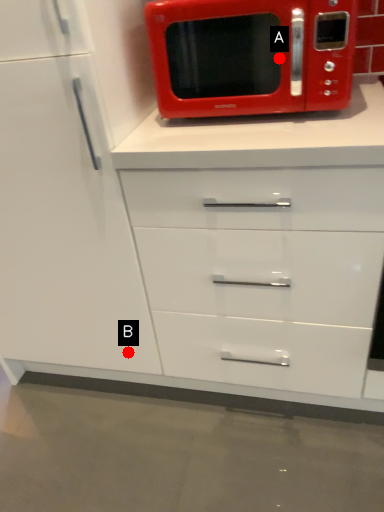
Question: Two points are circled on the image, labeled by A and B beside each circle. Which point is closer to the camera taking this photo?

Choices:
 (A) A is closer
 (B) B is closer

Answer: (A)